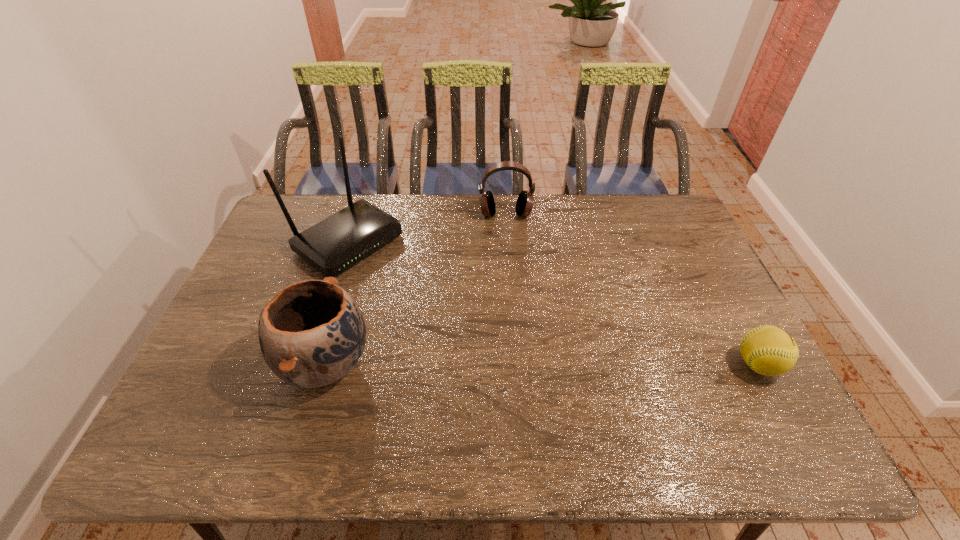
Find the location of a particular element. The width and height of the screenshot is (960, 540). free spot between the pottery and the rightmost object is located at coordinates (542, 364).

You are a GUI agent. You are given a task and a screenshot of the screen. Output one action in this format:
    pyautogui.click(x=<x>, y=<y>)
    Task: Click on the free space between the tallest object and the shortest object
    The height and width of the screenshot is (540, 960).
    Given the screenshot: What is the action you would take?
    pyautogui.click(x=553, y=303)

You are a GUI agent. You are given a task and a screenshot of the screen. Output one action in this format:
    pyautogui.click(x=<x>, y=<y>)
    Task: Click on the object that is the closest to the headset
    Image resolution: width=960 pixels, height=540 pixels.
    Given the screenshot: What is the action you would take?
    pyautogui.click(x=333, y=245)

You are a GUI agent. You are given a task and a screenshot of the screen. Output one action in this format:
    pyautogui.click(x=<x>, y=<y>)
    Task: Click on the third closest object relative to the headset
    
    Given the screenshot: What is the action you would take?
    pyautogui.click(x=768, y=350)

Locate an element on the screen. This screenshot has height=540, width=960. free space that satisfies the following two spatial constraints: 1. on the front side of the pottery; 2. on the left side of the router is located at coordinates (309, 363).